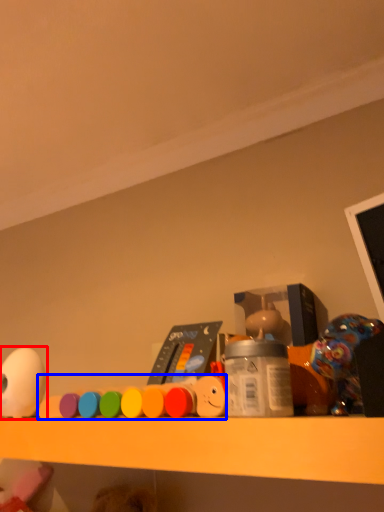
Question: Which object appears farthest to the camera in this image, toy (highlighted by a red box) or toy (highlighted by a blue box)?

Choices:
 (A) toy
 (B) toy

Answer: (A)